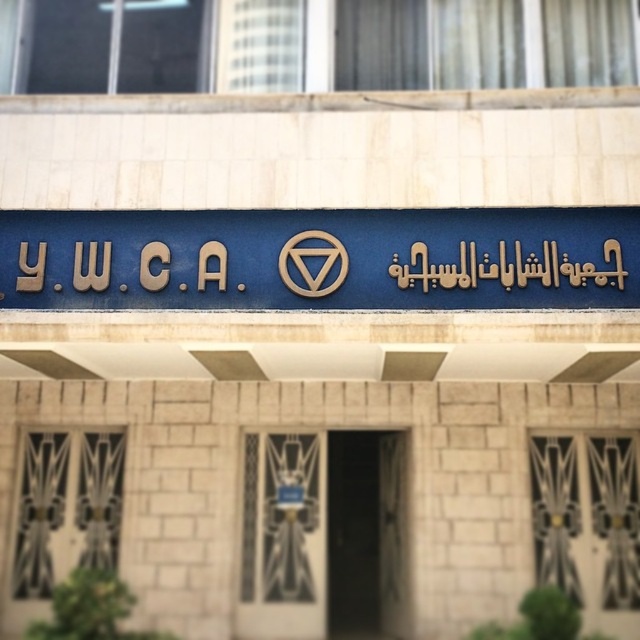
Is blue metallic sign at center closer to the viewer compared to gold metallic signboard at center?

Yes, blue metallic sign at center is in front of gold metallic signboard at center.

Can you confirm if blue metallic sign at center is positioned below gold metallic signboard at center?

Incorrect, blue metallic sign at center is not positioned below gold metallic signboard at center.

I want to click on blue metallic sign at center, so click(321, 259).

Locate an element on the screen. blue metallic sign at center is located at coordinates (321, 259).